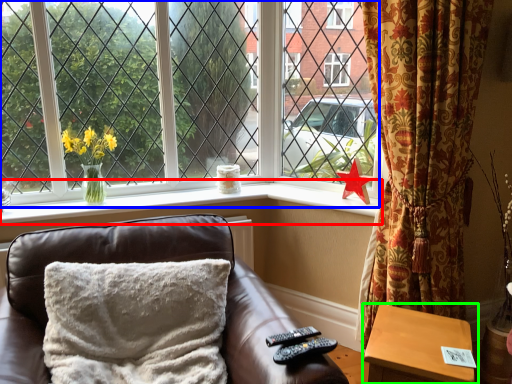
Question: Which is farther away from window sill (highlighted by a red box)? window (highlighted by a blue box) or table (highlighted by a green box)?

Choices:
 (A) window
 (B) table

Answer: (B)